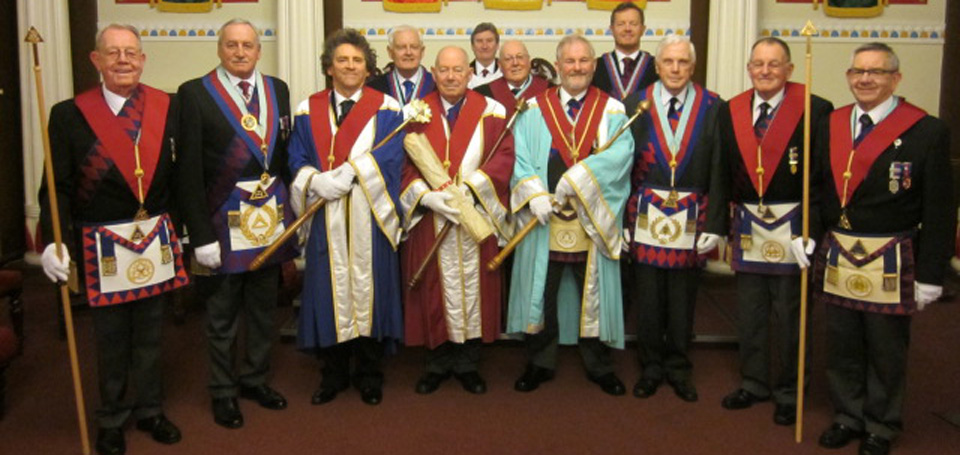
Locate an element on the screen. robes is located at coordinates (358, 287), (469, 290), (577, 296).